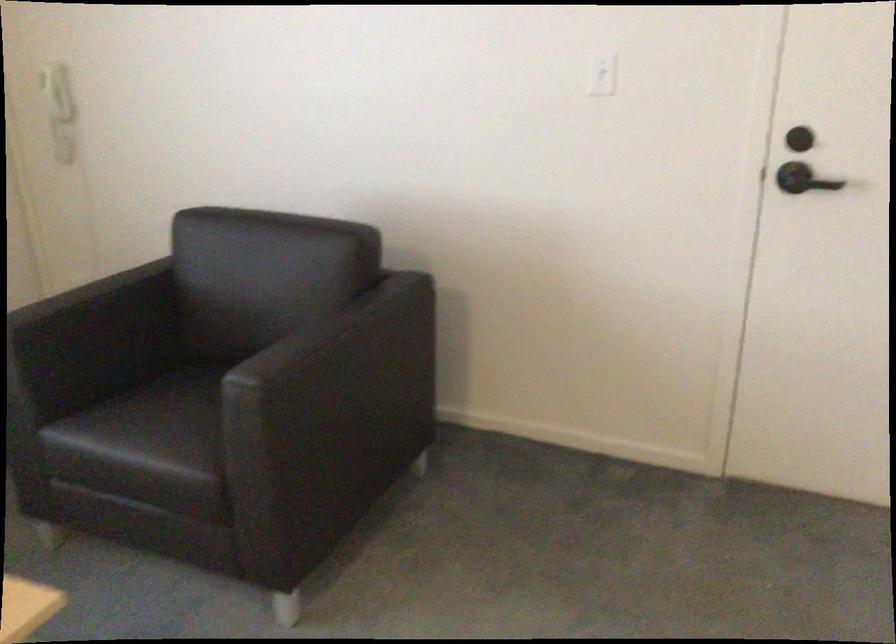
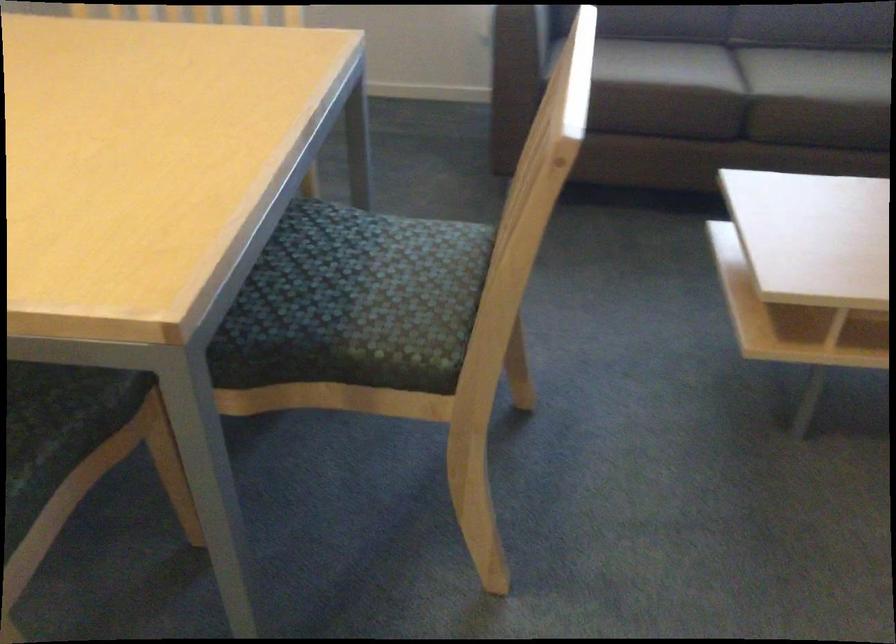
The first image is from the beginning of the video and the second image is from the end. How did the camera likely rotate when shooting the video?

The camera rotated toward left-down.